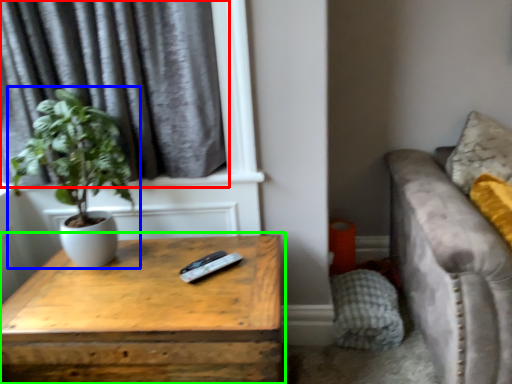
Question: Which is nearer to the curtain (highlighted by a red box)? houseplant (highlighted by a blue box) or table (highlighted by a green box).

Choices:
 (A) houseplant
 (B) table

Answer: (A)